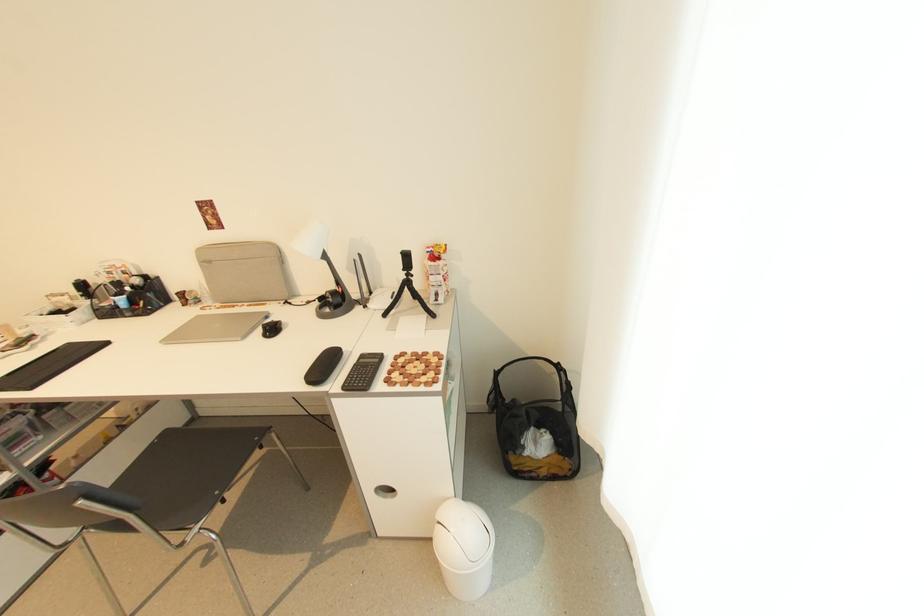
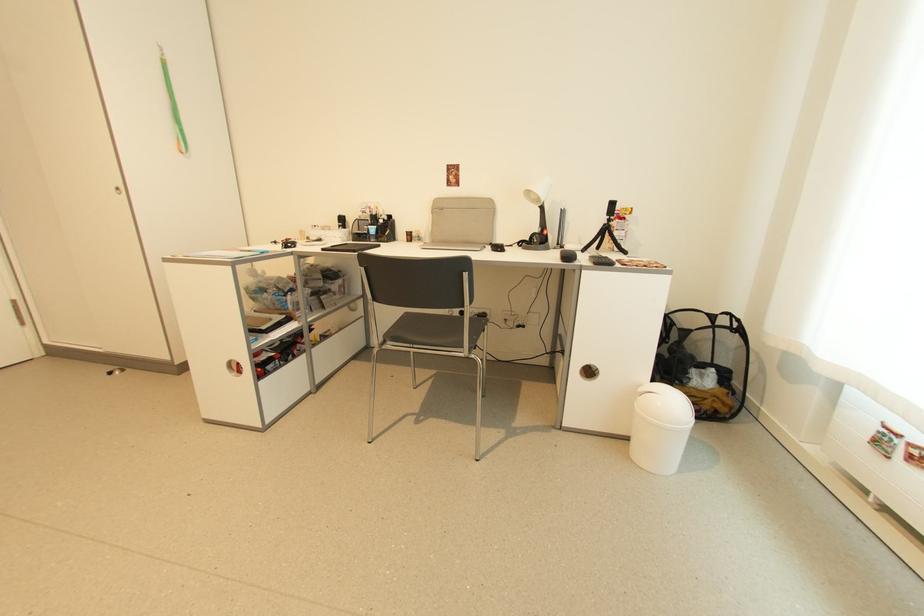
In the second image, find the point that corresponds to point 348,390 in the first image.

(600, 265)